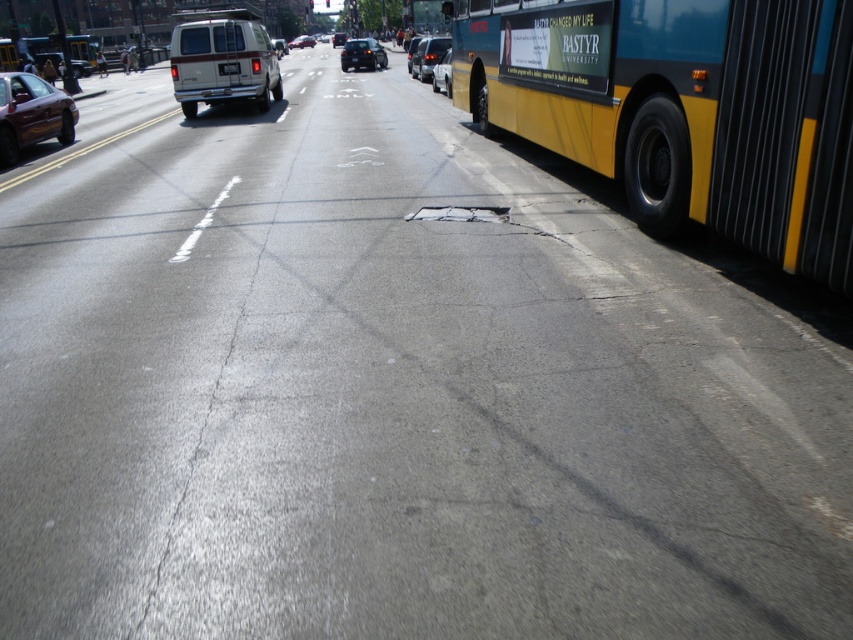
You are a pedestrian standing at the edge of the road. You see the matte black sedan at center and the white plastic license plate at center. Which object is closer to you?

The matte black sedan at center is closer to you than the white plastic license plate at center, so the matte black sedan at center is closer.